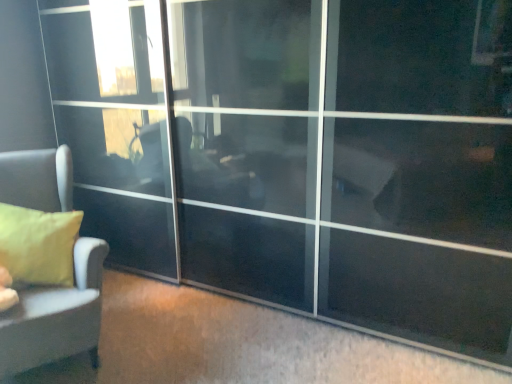
Question: Should I look upward or downward to see matte gray sofa at left?

Choices:
 (A) up
 (B) down

Answer: (B)

Question: Can matte yellow pillow at left be found inside transparent glass screen door at center?

Choices:
 (A) no
 (B) yes

Answer: (A)

Question: From the image's perspective, is transparent glass screen door at center below matte yellow pillow at left?

Choices:
 (A) yes
 (B) no

Answer: (B)

Question: Is transparent glass screen door at center at the left side of matte yellow pillow at left?

Choices:
 (A) no
 (B) yes

Answer: (A)

Question: Does transparent glass screen door at center come behind matte yellow pillow at left?

Choices:
 (A) yes
 (B) no

Answer: (B)

Question: Considering the relative positions of transparent glass screen door at center and matte yellow pillow at left in the image provided, is transparent glass screen door at center to the right of matte yellow pillow at left from the viewer's perspective?

Choices:
 (A) yes
 (B) no

Answer: (A)

Question: Could you tell me if transparent glass screen door at center is turned towards matte yellow pillow at left?

Choices:
 (A) yes
 (B) no

Answer: (A)

Question: From the image's perspective, is matte yellow pillow at left on transparent glass screen door at center?

Choices:
 (A) yes
 (B) no

Answer: (B)

Question: Are matte yellow pillow at left and transparent glass screen door at center making contact?

Choices:
 (A) no
 (B) yes

Answer: (A)

Question: Is matte yellow pillow at left positioned in front of transparent glass screen door at center?

Choices:
 (A) yes
 (B) no

Answer: (B)

Question: From the image's perspective, is matte yellow pillow at left beneath transparent glass screen door at center?

Choices:
 (A) yes
 (B) no

Answer: (A)

Question: From a real-world perspective, is matte yellow pillow at left positioned over transparent glass screen door at center based on gravity?

Choices:
 (A) no
 (B) yes

Answer: (A)

Question: Is the position of matte yellow pillow at left more distant than that of transparent glass screen door at center?

Choices:
 (A) yes
 (B) no

Answer: (A)

Question: Is matte gray sofa at left oriented away from transparent glass screen door at center?

Choices:
 (A) yes
 (B) no

Answer: (B)